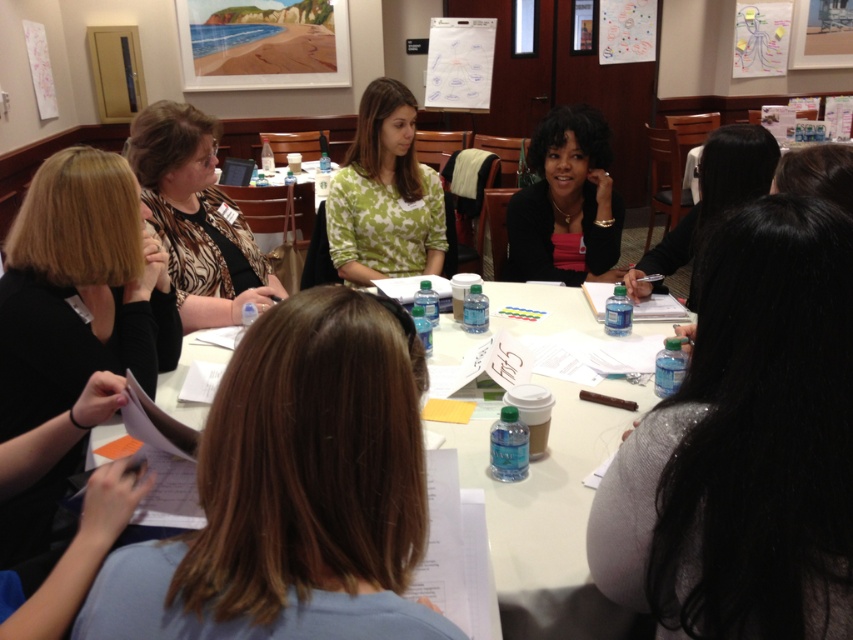
Question: Is black matte hair at left bigger than matte black jacket at center?

Choices:
 (A) yes
 (B) no

Answer: (A)

Question: Estimate the real-world distances between objects in this image. Which object is farther from the white paper at center?

Choices:
 (A) black hair at center
 (B) white paperboard at upper center
 (C) gray fabric shirt at lower right
 (D) green floral shirt at center

Answer: (B)

Question: Which of these objects is positioned farthest from the green floral shirt at center?

Choices:
 (A) white paperboard at upper center
 (B) black matte hair at left

Answer: (A)

Question: Is gray fabric shirt at lower right below printed fabric blouse at left?

Choices:
 (A) no
 (B) yes

Answer: (B)

Question: Which of the following is the closest to the observer?

Choices:
 (A) matte black jacket at center
 (B) white paperboard at upper center
 (C) green floral shirt at center

Answer: (A)

Question: Is the position of gray fabric shirt at lower right less distant than that of printed fabric blouse at left?

Choices:
 (A) no
 (B) yes

Answer: (B)